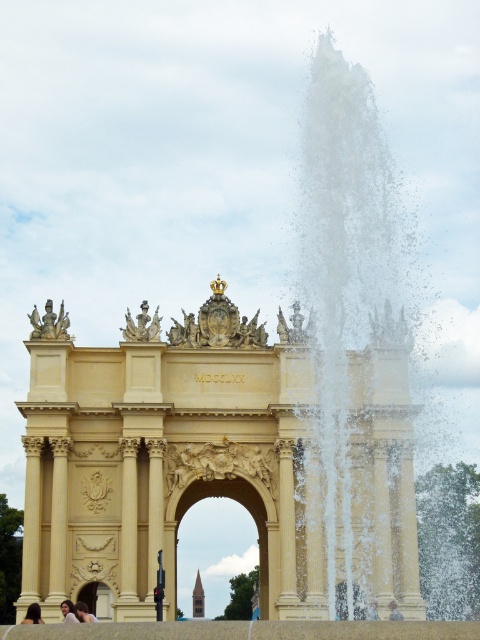
Question: Which point is closer to the camera?

Choices:
 (A) (31, 604)
 (B) (70, 620)
 (C) (84, 621)

Answer: (B)

Question: Can you confirm if blonde hair at lower left is thinner than light brown hair at lower left?

Choices:
 (A) yes
 (B) no

Answer: (B)

Question: Can you confirm if light brown hair at lower left is positioned to the right of light brown hair at center?

Choices:
 (A) yes
 (B) no

Answer: (B)

Question: Which object is closer to the camera taking this photo?

Choices:
 (A) blonde hair at lower left
 (B) blonde hair person at lower left

Answer: (A)

Question: Which point is closer to the camera taking this photo?

Choices:
 (A) (68, 605)
 (B) (32, 609)
 (C) (388, 618)

Answer: (B)

Question: Does blonde hair person at lower left have a larger size compared to light brown hair at lower left?

Choices:
 (A) yes
 (B) no

Answer: (B)